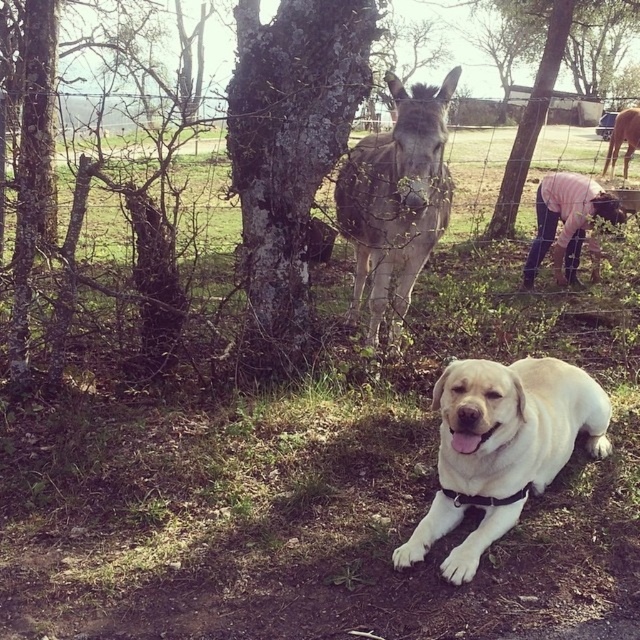
You are a hiker lost in a forest and see the smooth bark tree at center and the dark gray bark tree at center. Which tree should you head toward if you want to find the one on the right side?

You should head toward the smooth bark tree at center because it is located to the right of the dark gray bark tree at center.

You are trying to decide which tree to climb between the smooth bark tree at center and the dark gray bark tree at center. Based on their widths, which one would be easier to climb?

The smooth bark tree at center might be wider than dark gray bark tree at center, so it could provide a larger surface area to grip, making it potentially easier to climb.